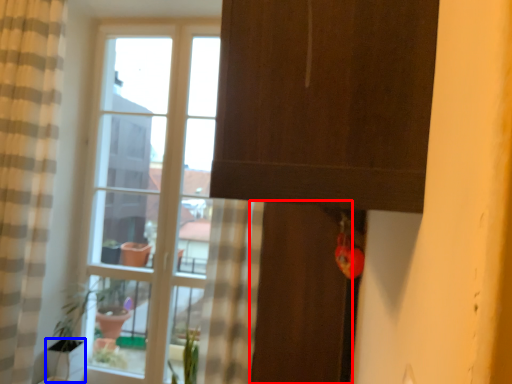
Question: Which of the following is the closest to the observer, screen door (highlighted by a red box) or glass vase (highlighted by a blue box)?

Choices:
 (A) screen door
 (B) glass vase

Answer: (A)